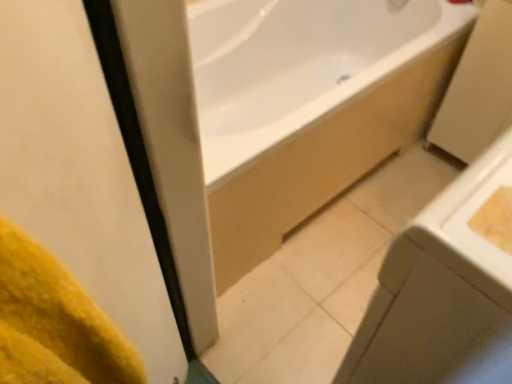
Question: Does white glossy sink at lower right have a lesser width compared to white glossy bathtub at upper center?

Choices:
 (A) yes
 (B) no

Answer: (A)

Question: Considering the relative positions of white glossy sink at lower right and white glossy bathtub at upper center in the image provided, is white glossy sink at lower right to the right of white glossy bathtub at upper center from the viewer's perspective?

Choices:
 (A) yes
 (B) no

Answer: (A)

Question: Can you confirm if white glossy sink at lower right is shorter than white glossy bathtub at upper center?

Choices:
 (A) yes
 (B) no

Answer: (B)

Question: Considering the relative sizes of white glossy sink at lower right and white glossy bathtub at upper center in the image provided, is white glossy sink at lower right wider than white glossy bathtub at upper center?

Choices:
 (A) no
 (B) yes

Answer: (A)

Question: From the image's perspective, does white glossy sink at lower right appear lower than white glossy bathtub at upper center?

Choices:
 (A) no
 (B) yes

Answer: (B)

Question: From a real-world perspective, is white glossy sink at lower right positioned under white glossy bathtub at upper center based on gravity?

Choices:
 (A) no
 (B) yes

Answer: (A)

Question: Is white glossy sink at lower right surrounded by white glossy bathtub at upper center?

Choices:
 (A) yes
 (B) no

Answer: (B)

Question: Is white glossy bathtub at upper center looking in the opposite direction of white glossy sink at lower right?

Choices:
 (A) yes
 (B) no

Answer: (B)

Question: Is white glossy bathtub at upper center shorter than white glossy sink at lower right?

Choices:
 (A) yes
 (B) no

Answer: (A)

Question: Considering the relative positions of white glossy bathtub at upper center and white glossy sink at lower right in the image provided, is white glossy bathtub at upper center to the right of white glossy sink at lower right from the viewer's perspective?

Choices:
 (A) yes
 (B) no

Answer: (B)

Question: Is white glossy bathtub at upper center bigger than white glossy sink at lower right?

Choices:
 (A) yes
 (B) no

Answer: (A)

Question: Would you consider white glossy bathtub at upper center to be distant from white glossy sink at lower right?

Choices:
 (A) no
 (B) yes

Answer: (A)

Question: Can you confirm if white glossy sink at lower right is thinner than yellow fabric at left?

Choices:
 (A) no
 (B) yes

Answer: (A)